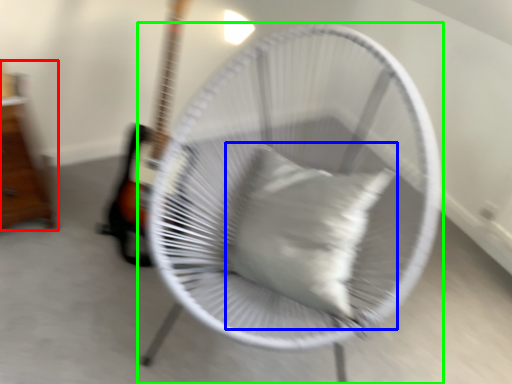
Question: Which is nearer to the furniture (highlighted by a red box)? pillow (highlighted by a blue box) or mechanical fan (highlighted by a green box).

Choices:
 (A) pillow
 (B) mechanical fan

Answer: (B)